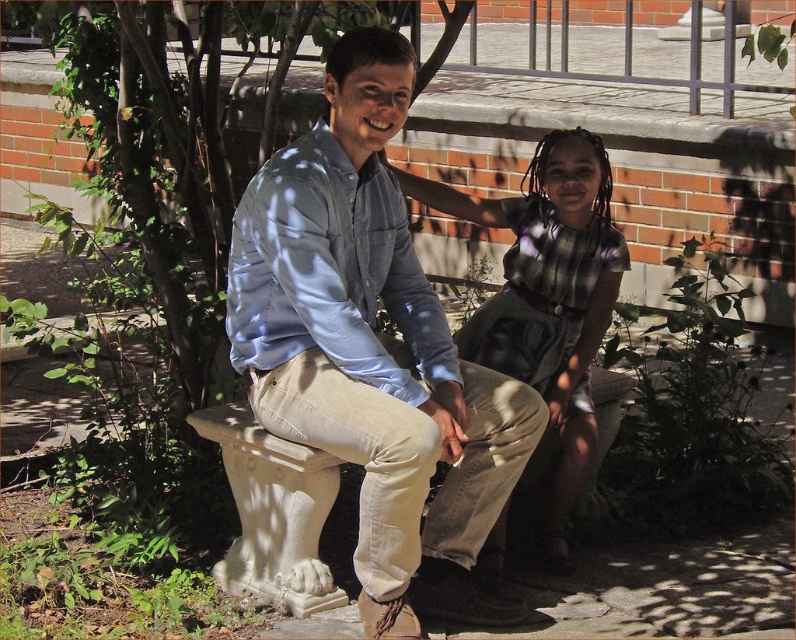
Question: From the image, what is the correct spatial relationship of light blue denim shirt at center in relation to matte blue shirt at center?

Choices:
 (A) left
 (B) right

Answer: (A)

Question: Is light blue denim shirt at center thinner than matte blue shirt at center?

Choices:
 (A) yes
 (B) no

Answer: (B)

Question: Which point appears closest to the camera in this image?

Choices:
 (A) (480, 321)
 (B) (334, 337)

Answer: (B)

Question: Does light blue denim shirt at center have a smaller size compared to matte blue shirt at center?

Choices:
 (A) no
 (B) yes

Answer: (A)

Question: Which of the following is the farthest from the observer?

Choices:
 (A) matte blue shirt at center
 (B) light blue denim shirt at center

Answer: (A)